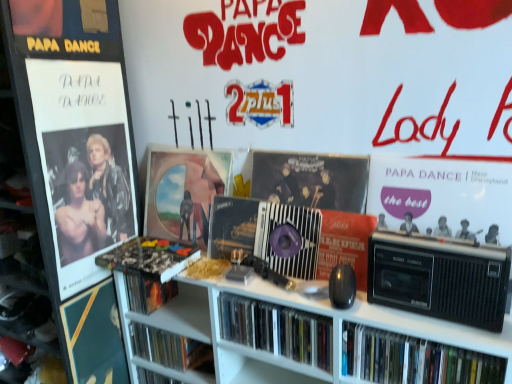
At what (x,y) coordinates should I click in order to perform the action: click on vacant region above black plastic cassette at right, which appears as the 1th cassette when viewed from the right (from a real-world perspective). Please return your answer as a coordinate pair (x, y). The height and width of the screenshot is (384, 512). Looking at the image, I should click on (443, 244).